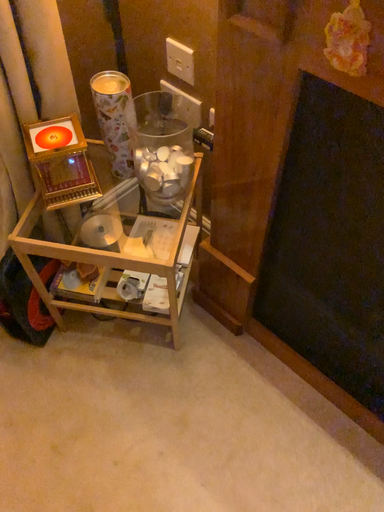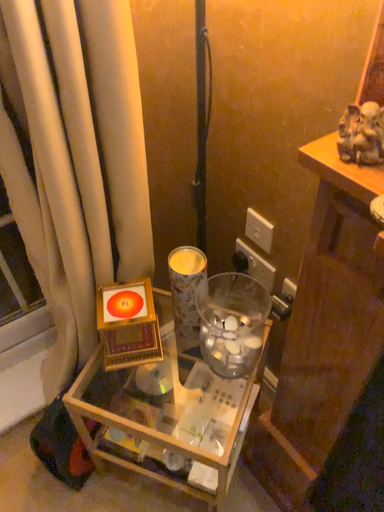
Question: How did the camera likely rotate when shooting the video?

Choices:
 (A) rotated right
 (B) rotated left

Answer: (B)